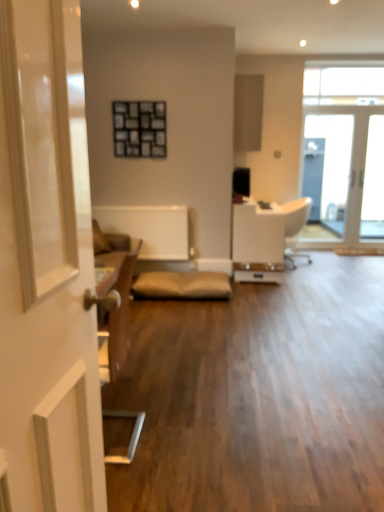
Question: From a real-world perspective, is white leather armchair at center positioned above or below white glossy door at left?

Choices:
 (A) above
 (B) below

Answer: (B)

Question: Considering the positions of white leather armchair at center and white glossy door at left in the image, is white leather armchair at center bigger or smaller than white glossy door at left?

Choices:
 (A) small
 (B) big

Answer: (B)

Question: Which of these objects is positioned farthest from the clear glass door at upper right, which is the first window in bottom-to-top order?

Choices:
 (A) transparent glass window at upper right, arranged as the second window when ordered from the bottom
 (B) white glossy door at left
 (C) white leather armchair at center
 (D) matte wood cabinet at upper center

Answer: (B)

Question: Based on their relative distances, which object is farther from the white leather armchair at center?

Choices:
 (A) matte wood cabinet at upper center
 (B) white glossy door at left
 (C) transparent glass window at upper right, which ranks as the 1th window in top-to-bottom order
 (D) clear glass door at upper right, marked as the second window in a top-to-bottom arrangement

Answer: (B)